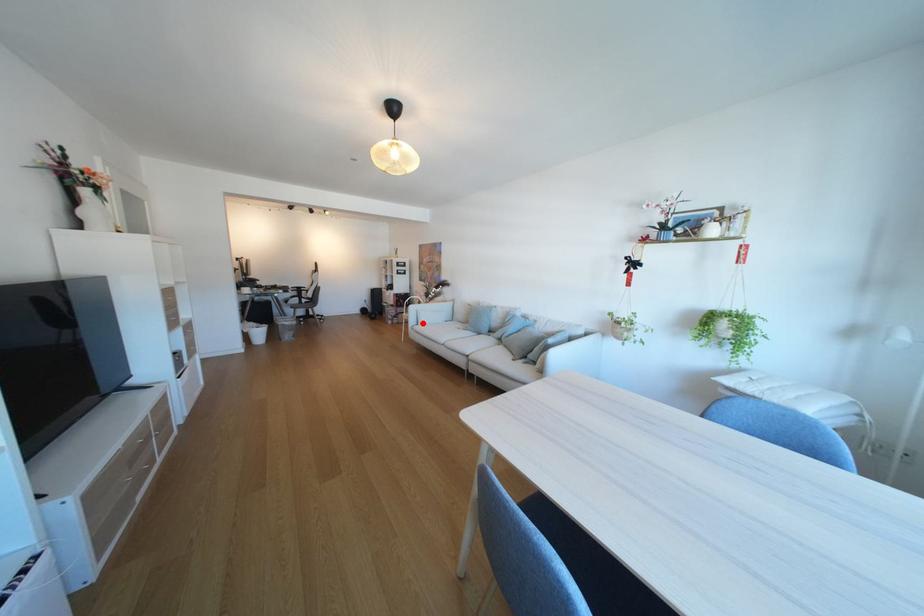
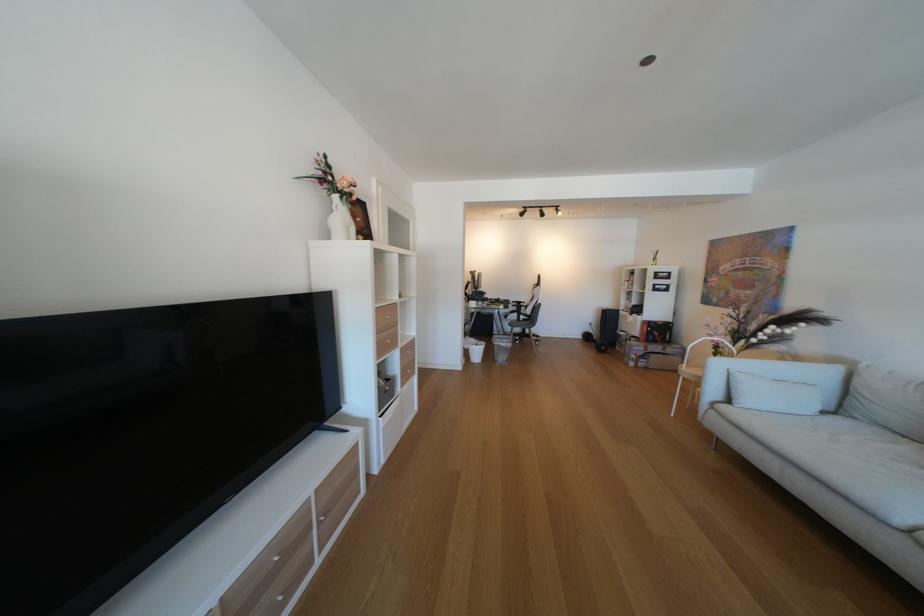
Locate, in the second image, the point that corresponds to the highlighted location in the first image.

(723, 392)